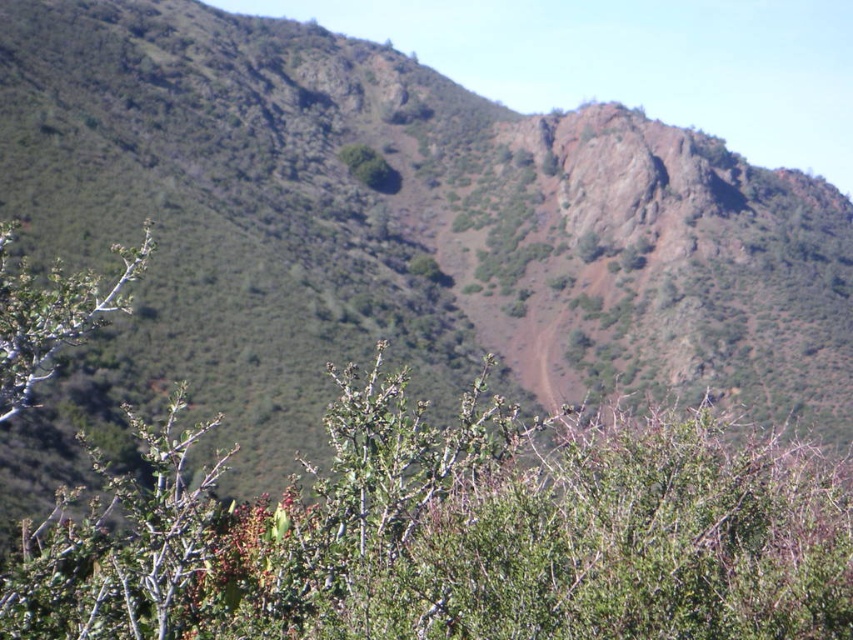
You are standing at the base of the hillside and see two points marked in the image. The first point is at coordinates point (x=93, y=602) and the second is at point (x=61, y=301). Which point is closer to you?

Point (x=93, y=602) is in front of point (x=61, y=301), so the first point is closer to you.

Consider the image. You are standing at the bottom of the hill and see the green leafy bush at center. Based on its position, can you estimate its location relative to the center of the image?

The green leafy bush at center is located at point 0.838 on the x axis and 0.533 on the y axis, so it is slightly to the right and above the center of the image.

You are a hiker trying to navigate through the rugged hillside. You notice a green leafy bush at center and a green leafy shrub at left. Which one is shorter?

The green leafy bush at center is not as tall as the green leafy shrub at left, so the green leafy bush at center is shorter.